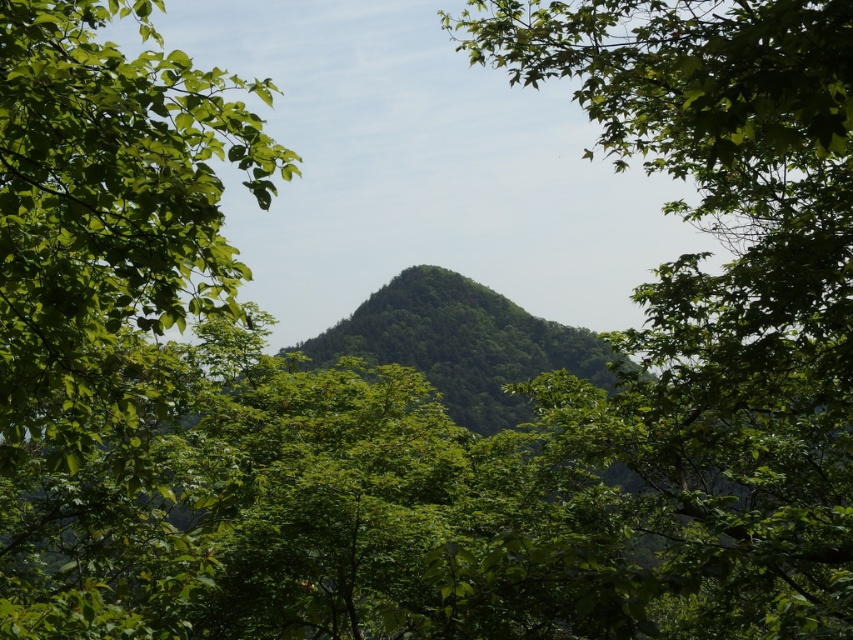
Based on the photo, you are standing at the origin point in the image. Where is the green leafy tree at center located in terms of its 2D coordinates?

The green leafy tree at center is located at the 2D coordinates of point (722,291).

You are standing in a forest and see two points marked in the image. The first point is at coordinate point(724, 353) and the second is at point(552, 353). Which point is closer to you?

Point(724, 353) is in front of point(552, 353), so it is closer to you.

In the scene shown: You are standing in a forest and see the green leafy tree at center and the green leafy hillside at center. Which object is taller?

The green leafy tree at center is taller than the green leafy hillside at center according to the description.